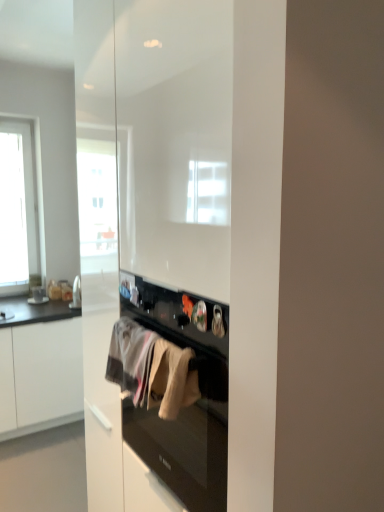
Where is `white cotton towel at center, placed as the 2th clothing when sorted from front to back`? This screenshot has width=384, height=512. white cotton towel at center, placed as the 2th clothing when sorted from front to back is located at coordinates [x=122, y=351].

The height and width of the screenshot is (512, 384). Identify the location of white matte cabinet at left. (40, 370).

Locate an element on the screen. clothing that is the 2nd object above the white matte cabinet at left (from a real-world perspective) is located at coordinates (171, 379).

From a real-world perspective, between white matte cabinet at left and white cotton towel at center, placed as the 2th clothing when sorted from left to right, who is vertically higher?

white cotton towel at center, placed as the 2th clothing when sorted from left to right, is physically above.

From the image's perspective, is white matte cabinet at left beneath white cotton towel at center, which is the first clothing from front to back?

Correct, white matte cabinet at left appears lower than white cotton towel at center, which is the first clothing from front to back, in the image.

How far apart are white cotton towel at center, which is the first clothing from front to back, and white matte cabinet at left?

white cotton towel at center, which is the first clothing from front to back, and white matte cabinet at left are 2.14 meters apart from each other.

Between white cotton towel at center, which is the first clothing from front to back, and white matte cabinet at left, which one has smaller width?

Thinner between the two is white cotton towel at center, which is the first clothing from front to back.

Which is closer, (152, 369) or (38, 380)?

The point (152, 369) is closer.

Based on the photo, is white cotton towel at center, the 1th clothing when ordered from right to left, aimed at white matte cabinet at left?

No.

Could you measure the distance between white cotton towel at center, the 1th clothing when ordered from right to left, and white cotton towel at center, placed as the 2th clothing when sorted from front to back?

white cotton towel at center, the 1th clothing when ordered from right to left, is 6.48 inches from white cotton towel at center, placed as the 2th clothing when sorted from front to back.

From a real-world perspective, which is physically below, white cotton towel at center, the 2th clothing in the back-to-front sequence, or white cotton towel at center, marked as the second clothing in a right-to-left arrangement?

white cotton towel at center, marked as the second clothing in a right-to-left arrangement, from a real-world perspective.

You are a GUI agent. You are given a task and a screenshot of the screen. Output one action in this format:
    pyautogui.click(x=<x>, y=<y>)
    Task: Click on the clothing lying on the left of white cotton towel at center, the 1th clothing when ordered from right to left
    Image resolution: width=384 pixels, height=512 pixels.
    Given the screenshot: What is the action you would take?
    pyautogui.click(x=122, y=351)

Considering the points (191, 375) and (113, 370), which point is behind, point (191, 375) or point (113, 370)?

The point (113, 370) is behind.

From a real-world perspective, which object rests below the other?

From a 3D spatial view, white cotton towel at center, placed as the 2th clothing when sorted from front to back, is below.

Can you tell me how much white cotton towel at center, the first clothing in the left-to-right sequence, and white cotton towel at center, the 1th clothing when ordered from right to left, differ in facing direction?

There is a 2.72-degree angle between the facing directions of white cotton towel at center, the first clothing in the left-to-right sequence, and white cotton towel at center, the 1th clothing when ordered from right to left.

Considering the sizes of objects white cotton towel at center, the first clothing in the left-to-right sequence, and white cotton towel at center, which is the first clothing from front to back, in the image provided, who is shorter, white cotton towel at center, the first clothing in the left-to-right sequence, or white cotton towel at center, which is the first clothing from front to back,?

Standing shorter between the two is white cotton towel at center, which is the first clothing from front to back.

Is white cotton towel at center, marked as the second clothing in a right-to-left arrangement, looking in the opposite direction of white matte cabinet at left?

No, white cotton towel at center, marked as the second clothing in a right-to-left arrangement, is not facing the opposite direction of white matte cabinet at left.

From a real-world perspective, is white cotton towel at center, placed as the 2th clothing when sorted from front to back, on white matte cabinet at left?

Indeed, from a real-world perspective, white cotton towel at center, placed as the 2th clothing when sorted from front to back, stands above white matte cabinet at left.

Which is in front, point (114, 343) or point (49, 421)?

Point (114, 343)

From a real-world perspective, is white matte cabinet at left positioned under white cotton towel at center, placed as the 2th clothing when sorted from front to back, based on gravity?

Yes, from a real-world perspective, white matte cabinet at left is beneath white cotton towel at center, placed as the 2th clothing when sorted from front to back.

Starting from the white matte cabinet at left, which clothing is the 1st one in front? Please provide its 2D coordinates.

[(122, 351)]

Is white matte cabinet at left not within white cotton towel at center, marked as the second clothing in a right-to-left arrangement?

That's correct, white matte cabinet at left is outside of white cotton towel at center, marked as the second clothing in a right-to-left arrangement.

Does white matte cabinet at left turn towards white cotton towel at center, placed as the 2th clothing when sorted from front to back?

Yes, white matte cabinet at left is aimed at white cotton towel at center, placed as the 2th clothing when sorted from front to back.

Where is `the 2nd clothing in front when counting from the white matte cabinet at left`? the 2nd clothing in front when counting from the white matte cabinet at left is located at coordinates (171, 379).

This screenshot has width=384, height=512. Find the location of `clothing that is the 2nd one when counting rightward from the white matte cabinet at left`. clothing that is the 2nd one when counting rightward from the white matte cabinet at left is located at coordinates (171, 379).

From the image, which object appears to be farther from white matte cabinet at left, white cotton towel at center, the 2th clothing in the back-to-front sequence, or white cotton towel at center, which is the 1th clothing from back to front?

white cotton towel at center, the 2th clothing in the back-to-front sequence, is further to white matte cabinet at left.

Based on their spatial positions, is white matte cabinet at left or white cotton towel at center, placed as the 2th clothing when sorted from left to right, closer to white cotton towel at center, marked as the second clothing in a right-to-left arrangement?

white cotton towel at center, placed as the 2th clothing when sorted from left to right.

From the image, which object appears to be nearer to white cotton towel at center, which is the first clothing from front to back, white matte cabinet at left or white cotton towel at center, which is the 1th clothing from back to front?

white cotton towel at center, which is the 1th clothing from back to front.

Based on their spatial positions, is white cotton towel at center, which is the first clothing from front to back, or white matte cabinet at left further from white cotton towel at center, which is the 1th clothing from back to front?

white matte cabinet at left is positioned further to the anchor white cotton towel at center, which is the 1th clothing from back to front.

Which object lies nearer to the anchor point white matte cabinet at left, white cotton towel at center, placed as the 2th clothing when sorted from front to back, or white cotton towel at center, placed as the 2th clothing when sorted from left to right?

white cotton towel at center, placed as the 2th clothing when sorted from front to back, is positioned closer to the anchor white matte cabinet at left.

Looking at the image, which one is located further to white cotton towel at center, the 1th clothing when ordered from right to left, white cotton towel at center, the first clothing in the left-to-right sequence, or white matte cabinet at left?

white matte cabinet at left lies further to white cotton towel at center, the 1th clothing when ordered from right to left, than the other object.

Find the location of a particular element. The width and height of the screenshot is (384, 512). clothing positioned between white cotton towel at center, which is the first clothing from front to back, and white matte cabinet at left from near to far is located at coordinates (122, 351).